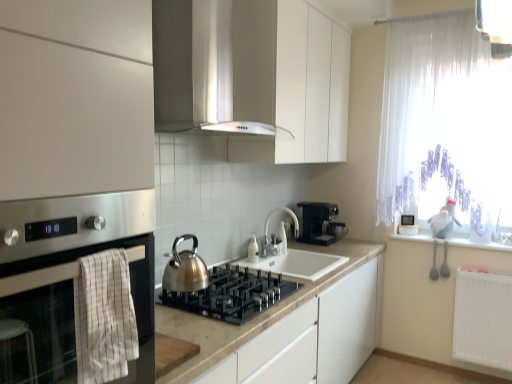
What is the approximate height of white glossy faucet at center?

white glossy faucet at center is 5.91 inches tall.

Find the location of a particular element. Image resolution: width=512 pixels, height=384 pixels. white glossy faucet at center is located at coordinates (253, 250).

What do you see at coordinates (423, 105) in the screenshot? I see `white sheer curtain at right` at bounding box center [423, 105].

You are a GUI agent. You are given a task and a screenshot of the screen. Output one action in this format:
    pyautogui.click(x=<x>, y=<y>)
    Task: Click on the black plastic coffee machine at center
    
    Given the screenshot: What is the action you would take?
    pyautogui.click(x=319, y=223)

Describe the element at coordinates (232, 294) in the screenshot. This screenshot has height=384, width=512. I see `black glass gas stove at center` at that location.

Where is `white striped towel at lower left`? white striped towel at lower left is located at coordinates (104, 317).

Image resolution: width=512 pixels, height=384 pixels. Find the location of `white matte cabinet at upper center`. white matte cabinet at upper center is located at coordinates (254, 76).

Measure the distance between white matte cabinet at upper center and camera.

1.74 meters.

This screenshot has height=384, width=512. Identify the location of white glossy faucet at center. (253, 250).

Which is behind, point (257, 257) or point (462, 303)?

The point (462, 303) is farther.

Is white glossy faucet at center positioned behind white plastic radiator at lower right?

No.

Between white glossy faucet at center and white plastic radiator at lower right, which one has less height?

With less height is white glossy faucet at center.

Find the location of a particular element. appliance on the left of white plastic radiator at lower right is located at coordinates (253, 250).

Considering the sizes of objects white sheer curtain at right and stainless steel oven at left in the image provided, who is wider, white sheer curtain at right or stainless steel oven at left?

stainless steel oven at left is wider.

Would you say white sheer curtain at right is inside or outside stainless steel oven at left?

white sheer curtain at right lies outside stainless steel oven at left.

Is white sheer curtain at right oriented away from stainless steel oven at left?

No.

Is point (440, 81) closer to camera compared to point (65, 381)?

No, it is not.

Is black glass gas stove at center oriented away from white plastic radiator at lower right?

No, black glass gas stove at center is not facing away from white plastic radiator at lower right.

From a real-world perspective, between black glass gas stove at center and white plastic radiator at lower right, who is vertically lower?

In real-world perspective, white plastic radiator at lower right is lower.

Is black plastic coffee machine at center to the right of white plastic radiator at lower right from the viewer's perspective?

No, black plastic coffee machine at center is not to the right of white plastic radiator at lower right.

From the image's perspective, is black plastic coffee machine at center positioned above or below white plastic radiator at lower right?

black plastic coffee machine at center is above white plastic radiator at lower right.

Is black plastic coffee machine at center surrounding white plastic radiator at lower right?

No, white plastic radiator at lower right is not a part of black plastic coffee machine at center.

From the image's perspective, is black plastic coffee machine at center above or below white glossy sink at center?

Clearly, from the image's perspective, black plastic coffee machine at center is above white glossy sink at center.

The height and width of the screenshot is (384, 512). In order to click on sink below the black plastic coffee machine at center (from a real-world perspective) in this screenshot , I will do `click(297, 264)`.

Considering the positions of points (318, 241) and (298, 259), is point (318, 241) closer to camera compared to point (298, 259)?

No, (318, 241) is behind (298, 259).

Based on their sizes in the image, would you say black plastic coffee machine at center is bigger or smaller than white glossy sink at center?

black plastic coffee machine at center is smaller than white glossy sink at center.

Consider the image. Is white glossy faucet at center inside the boundaries of white striped towel at lower left, or outside?

white glossy faucet at center is located beyond the bounds of white striped towel at lower left.

Is white glossy faucet at center facing away from white striped towel at lower left?

No, white glossy faucet at center's orientation is not away from white striped towel at lower left.

Can you see white glossy faucet at center touching white striped towel at lower left?

No, white glossy faucet at center is not with white striped towel at lower left.

From the picture: What's the angular difference between white glossy faucet at center and white striped towel at lower left's facing directions?

0.475 degrees.

What's the angular difference between black glass gas stove at center and white striped towel at lower left's facing directions?

black glass gas stove at center and white striped towel at lower left are facing 0.499 degrees away from each other.

Can you confirm if black glass gas stove at center is thinner than white striped towel at lower left?

Incorrect, the width of black glass gas stove at center is not less than that of white striped towel at lower left.

Between black glass gas stove at center and white striped towel at lower left, which one appears on the right side from the viewer's perspective?

From the viewer's perspective, black glass gas stove at center appears more on the right side.

Which of these two, black glass gas stove at center or white striped towel at lower left, stands taller?

white striped towel at lower left is taller.

This screenshot has width=512, height=384. I want to click on appliance above the white plastic radiator at lower right (from a real-world perspective), so click(253, 250).

Locate an element on the screen. Image resolution: width=512 pixels, height=384 pixels. home appliance that is in front of the white sheer curtain at right is located at coordinates (89, 249).

From the image, which object appears to be farther from shiny metallic kettle at center, black glass gas stove at center or white glossy faucet at center?

white glossy faucet at center is positioned further to the anchor shiny metallic kettle at center.

Considering their positions, is white glossy faucet at center positioned closer to white striped towel at lower left than shiny metallic kettle at center?

shiny metallic kettle at center is positioned closer to the anchor white striped towel at lower left.

Considering their positions, is white glossy faucet at center positioned closer to shiny metallic kettle at center than black glass gas stove at center?

black glass gas stove at center.

When comparing their distances from white striped towel at lower left, does white sheer curtain at right or stainless steel oven at left seem closer?

stainless steel oven at left is closer to white striped towel at lower left.

Based on their spatial positions, is white plastic radiator at lower right or white glossy faucet at center further from stainless steel oven at left?

white plastic radiator at lower right lies further to stainless steel oven at left than the other object.

Which object lies further to the anchor point white plastic radiator at lower right, white striped towel at lower left or shiny metallic kettle at center?

Based on the image, white striped towel at lower left appears to be further to white plastic radiator at lower right.

Estimate the real-world distances between objects in this image. Which object is closer to black glass gas stove at center, white matte cabinet at upper center or stainless steel oven at left?

stainless steel oven at left.

Estimate the real-world distances between objects in this image. Which object is further from white matte cabinet at upper center, black plastic coffee machine at center or white glossy faucet at center?

Among the two, black plastic coffee machine at center is located further to white matte cabinet at upper center.

This screenshot has width=512, height=384. I want to click on kitchen appliance between white matte cabinet at upper center and black glass gas stove at center in the vertical direction, so click(x=185, y=268).

You are a GUI agent. You are given a task and a screenshot of the screen. Output one action in this format:
    pyautogui.click(x=<x>, y=<y>)
    Task: Click on the sink between stainless steel oven at left and white glossy faucet at center along the z-axis
    The height and width of the screenshot is (384, 512).
    Given the screenshot: What is the action you would take?
    pyautogui.click(x=297, y=264)

The height and width of the screenshot is (384, 512). I want to click on sink between stainless steel oven at left and white matte cabinet at upper center in the front-back direction, so click(x=297, y=264).

Where is `appliance between black glass gas stove at center and white plastic radiator at lower right in the horizontal direction`? The image size is (512, 384). appliance between black glass gas stove at center and white plastic radiator at lower right in the horizontal direction is located at coordinates (253, 250).